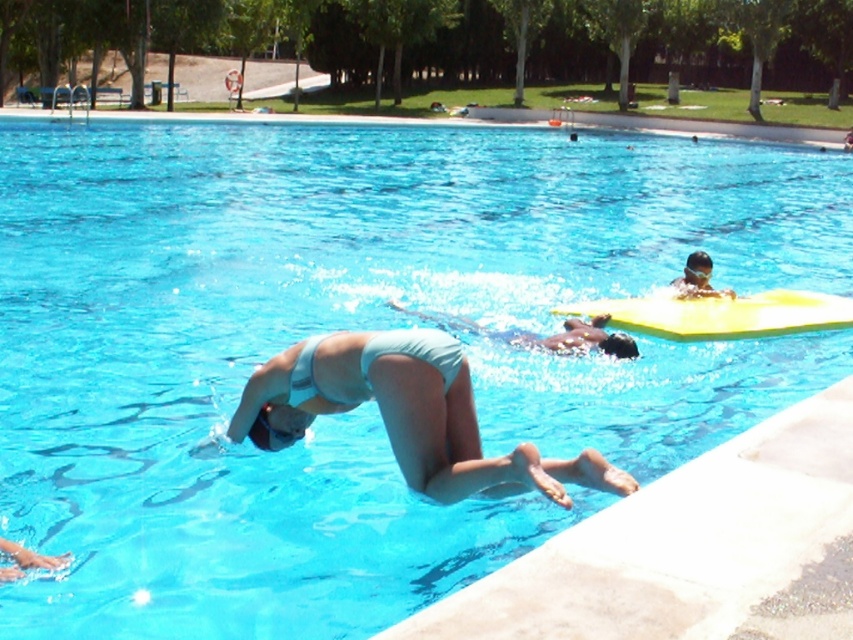
You are standing at the edge of the pool and want to reach the point marked at coordinates (608, 333). If your maximum reach is 8 meters, can you touch that point without moving closer?

The point at coordinates (608, 333) is 8.51 meters away from the viewer. Since your maximum reach is only 8 meters, you cannot touch that point without moving closer.

You are a lifeguard trying to locate two items in the pool area. You see the light blue fabric bikini at center and the matte blue swim cap at upper right. Which one has a greater width?

The light blue fabric bikini at center has a greater width than the matte blue swim cap at upper right.

You are a photographer trying to capture the perfect shot of the light blue fabric bikini at center and the light blue fabric swimmer at center. Which object should you focus on first if you want to highlight the taller one?

The light blue fabric bikini at center has a greater height compared to the light blue fabric swimmer at center, so you should focus on the light blue fabric bikini at center first to highlight its taller height.